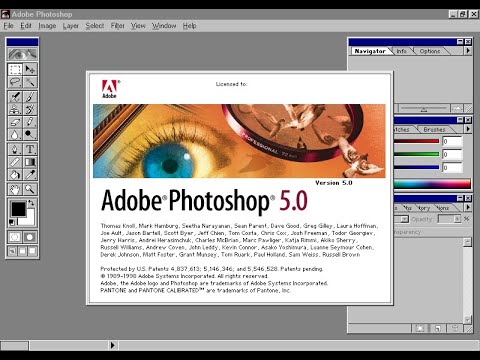
Where is `exit button`? The image size is (480, 360). exit button is located at coordinates (472, 14).